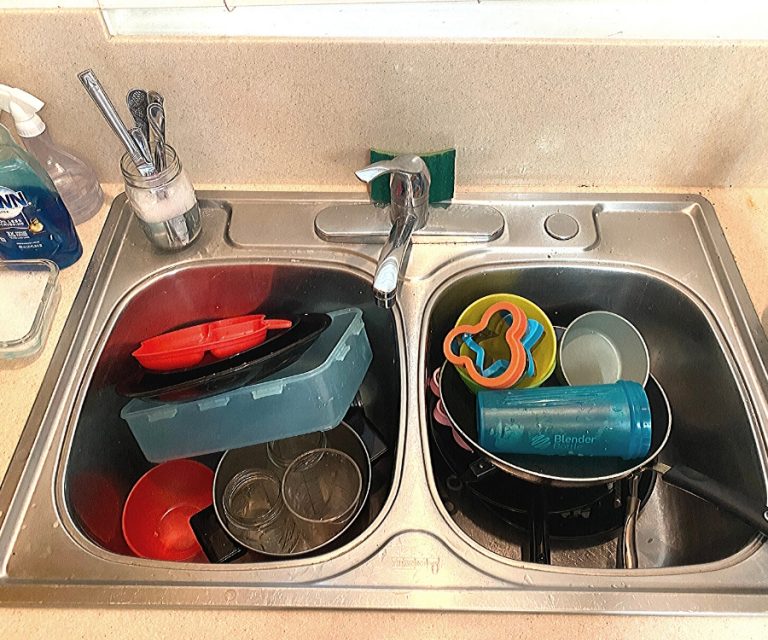
Where is `silver sink basin`? The width and height of the screenshot is (768, 640). silver sink basin is located at coordinates (286, 228), (415, 364), (406, 525), (624, 219), (737, 564).